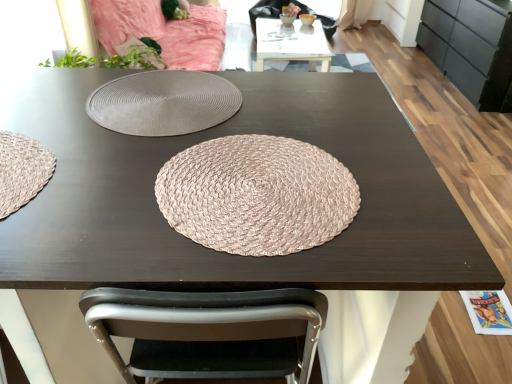
What are the coordinates of `empty space that is in between pink woven mat at center and matte gray placemat at center` in the screenshot? It's located at (164, 145).